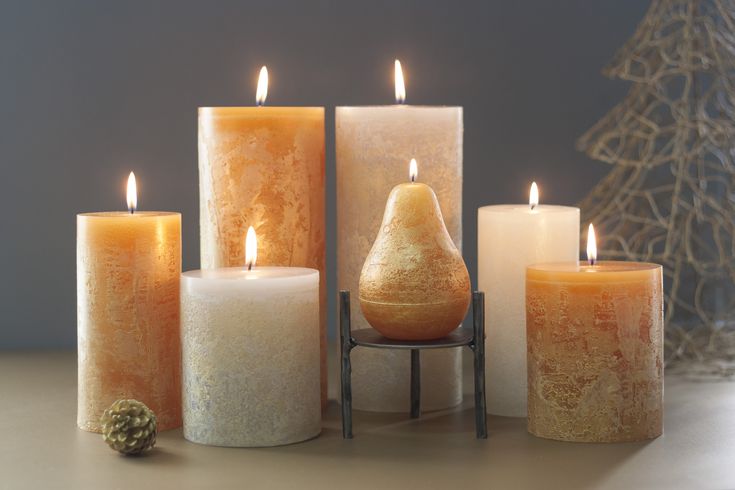
Locate an element on the screen. Image resolution: width=735 pixels, height=490 pixels. candles is located at coordinates (117, 318), (247, 358), (392, 275), (598, 384), (542, 253), (417, 128), (292, 148).